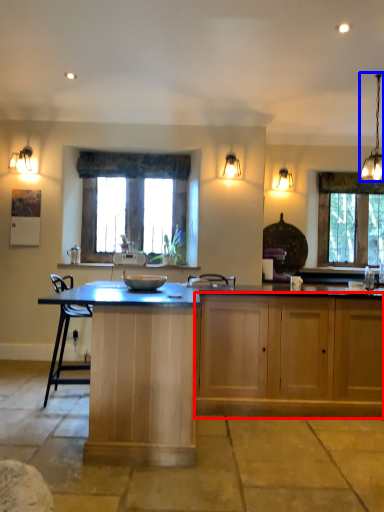
Question: Among these objects, which one is nearest to the camera, cabinetry (highlighted by a red box) or light fixture (highlighted by a blue box)?

Choices:
 (A) cabinetry
 (B) light fixture

Answer: (A)